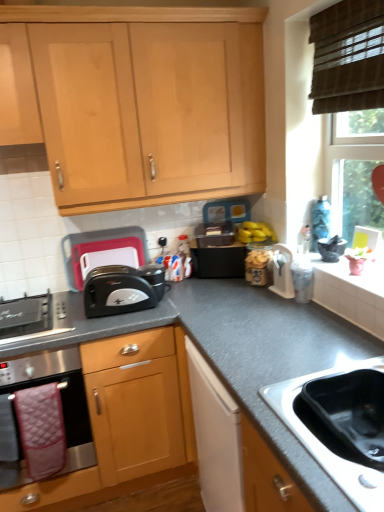
Question: Considering the positions of black plastic toaster at center-left, which appears as the 1th appliance when viewed from the back, and stainless steel oven at lower left in the image, is black plastic toaster at center-left, which appears as the 1th appliance when viewed from the back, wider or thinner than stainless steel oven at lower left?

Choices:
 (A) wide
 (B) thin

Answer: (B)

Question: Looking at the image, does black plastic toaster at center-left, the second appliance in the right-to-left sequence, seem bigger or smaller compared to stainless steel oven at lower left?

Choices:
 (A) big
 (B) small

Answer: (B)

Question: Considering the real-world distances, which object is farthest from the white plastic container at upper right, the second appliance in the back-to-front sequence?

Choices:
 (A) stainless steel oven at lower left
 (B) black plastic toaster at center
 (C) light wood cabinet at upper center, marked as the second cabinetry in a bottom-to-top arrangement
 (D) stainless steel sink at lower right
 (E) black plastic toaster at center-left, which appears as the 1th appliance when viewed from the back

Answer: (A)

Question: Which of these objects is positioned farthest from the stainless steel oven at lower left?

Choices:
 (A) stainless steel gas stove at lower left
 (B) white plastic container at upper right, the first appliance from the right
 (C) gray granite countertop at center
 (D) light wood cabinet at upper center, arranged as the 1th cabinetry when viewed from the top
 (E) black plastic toaster at center-left, the second appliance in the right-to-left sequence

Answer: (B)